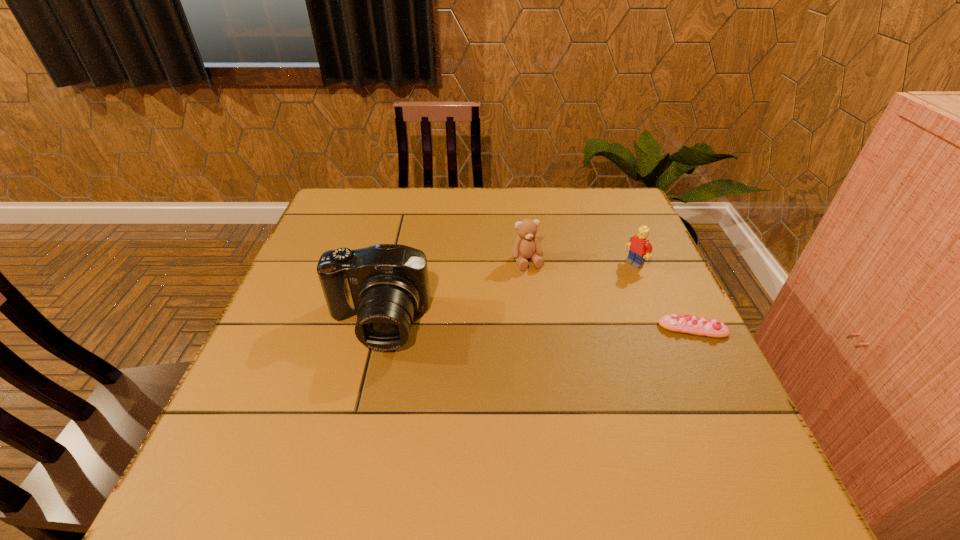
Where is `vacant space situated 0.310m on the front-facing side of the Lego`? The height and width of the screenshot is (540, 960). vacant space situated 0.310m on the front-facing side of the Lego is located at coordinates (540, 319).

You are a GUI agent. You are given a task and a screenshot of the screen. Output one action in this format:
    pyautogui.click(x=<x>, y=<y>)
    Task: Click on the vacant space situated on the front-facing side of the Lego
    The image size is (960, 540).
    Given the screenshot: What is the action you would take?
    pyautogui.click(x=615, y=275)

This screenshot has width=960, height=540. Identify the location of free space located on the front-facing side of the Lego. [527, 326].

Locate an element on the screen. The width and height of the screenshot is (960, 540). object that is at the left edge is located at coordinates (385, 285).

The width and height of the screenshot is (960, 540). What are the coordinates of `eclair present at the right edge` in the screenshot? It's located at (691, 325).

I want to click on Lego that is at the right edge, so click(x=640, y=248).

Locate an element on the screen. The height and width of the screenshot is (540, 960). vacant area at the far edge is located at coordinates (431, 208).

In the image, there is a desktop. What are the coordinates of `vacant space at the near edge` in the screenshot? It's located at (350, 437).

Identify the location of vacant space at the left edge of the desktop. This screenshot has width=960, height=540. (311, 316).

Locate an element on the screen. Image resolution: width=960 pixels, height=540 pixels. vacant space at the right edge of the desktop is located at coordinates (703, 379).